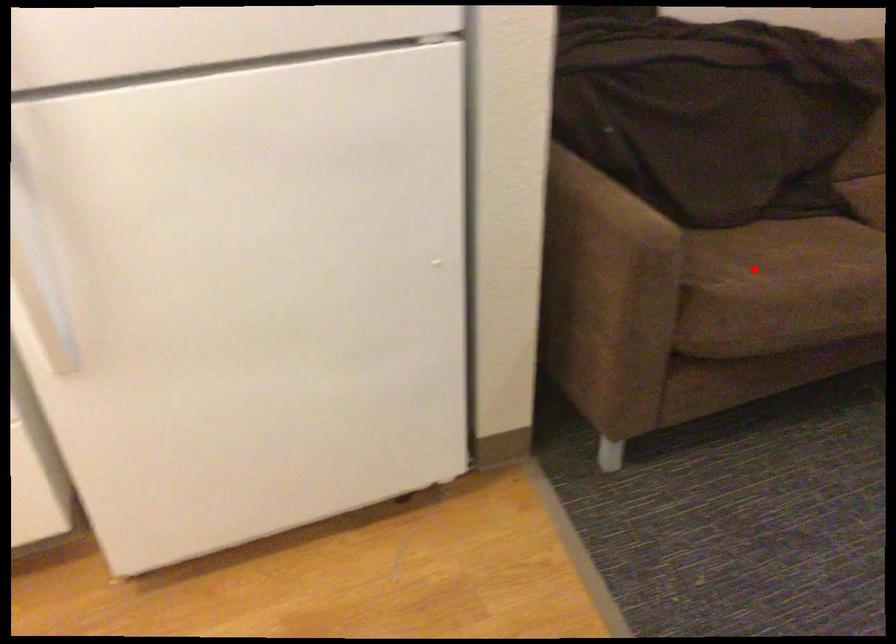
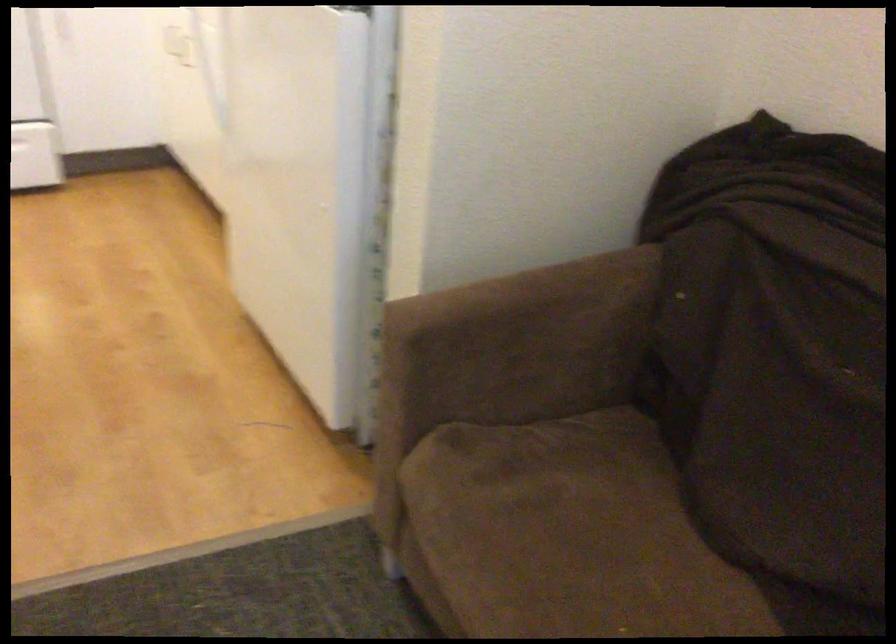
Question: A red point is marked in image1. In image2, is the corresponding 3D point closer to the camera or farther? Reply with the corresponding letter.

Choices:
 (A) The corresponding 3D point is closer.
 (B) The corresponding 3D point is farther.

Answer: (A)